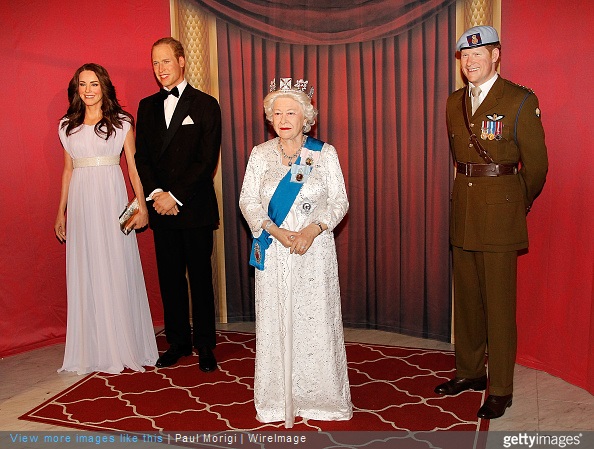
The height and width of the screenshot is (449, 594). In order to click on red curtain in this screenshot , I will do `click(375, 174)`.